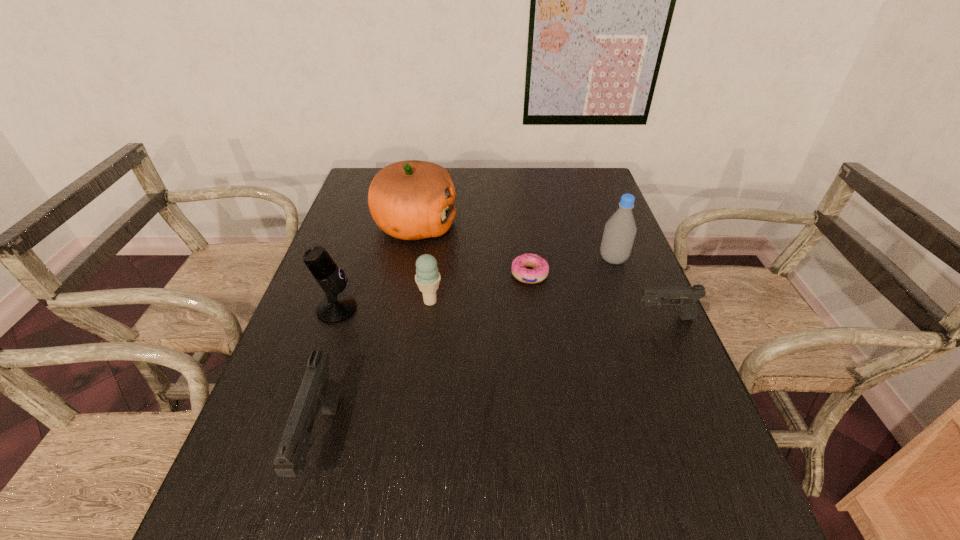
Image resolution: width=960 pixels, height=540 pixels. I want to click on vacant point located 0.340m at the barrel of the right pistol, so click(495, 318).

At what (x,y) coordinates should I click in order to perform the action: click on vacant space positioned 0.100m at the barrel of the right pistol. Please return your answer as a coordinate pair (x, y). Looking at the image, I should click on (592, 318).

Locate an element on the screen. This screenshot has height=540, width=960. free space located at the barrel of the right pistol is located at coordinates (613, 318).

Where is `vacant region located on the face of the pumpkin`? This screenshot has height=540, width=960. vacant region located on the face of the pumpkin is located at coordinates (564, 226).

At what (x,y) coordinates should I click in order to perform the action: click on blank area located 0.320m on the front of the fifth object from left to right. Please return your answer as a coordinate pair (x, y). Looking at the image, I should click on (544, 389).

This screenshot has height=540, width=960. I want to click on free space located on the stand of the microphone, so [400, 309].

The width and height of the screenshot is (960, 540). Identify the location of vacant space located on the front of the ice cream. (420, 392).

Image resolution: width=960 pixels, height=540 pixels. I want to click on free space located on the back of the bottle, so click(597, 214).

The width and height of the screenshot is (960, 540). In order to click on object at the near edge in this screenshot , I will do `click(318, 391)`.

At what (x,y) coordinates should I click in order to perform the action: click on pistol that is at the left edge. Please return your answer as a coordinate pair (x, y). The image size is (960, 540). Looking at the image, I should click on (318, 391).